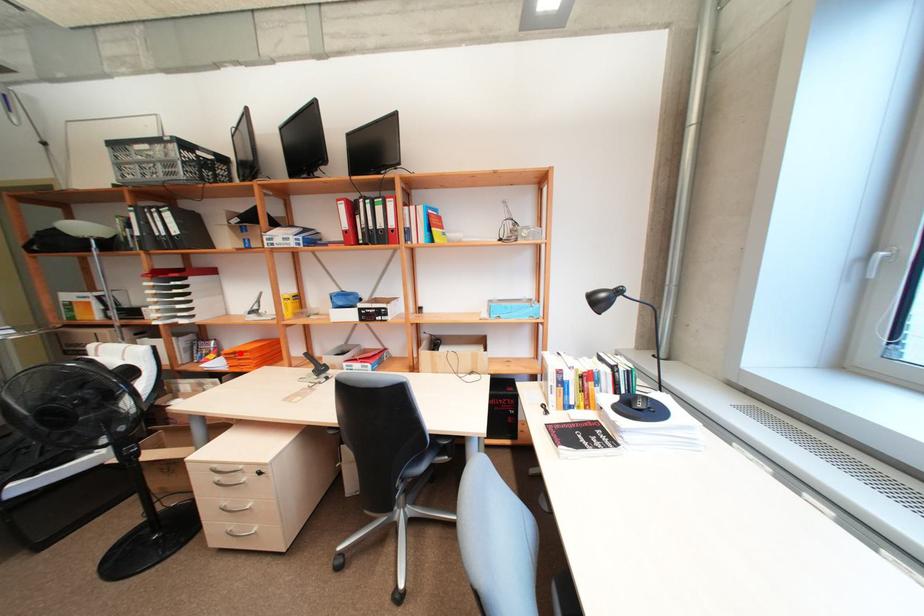
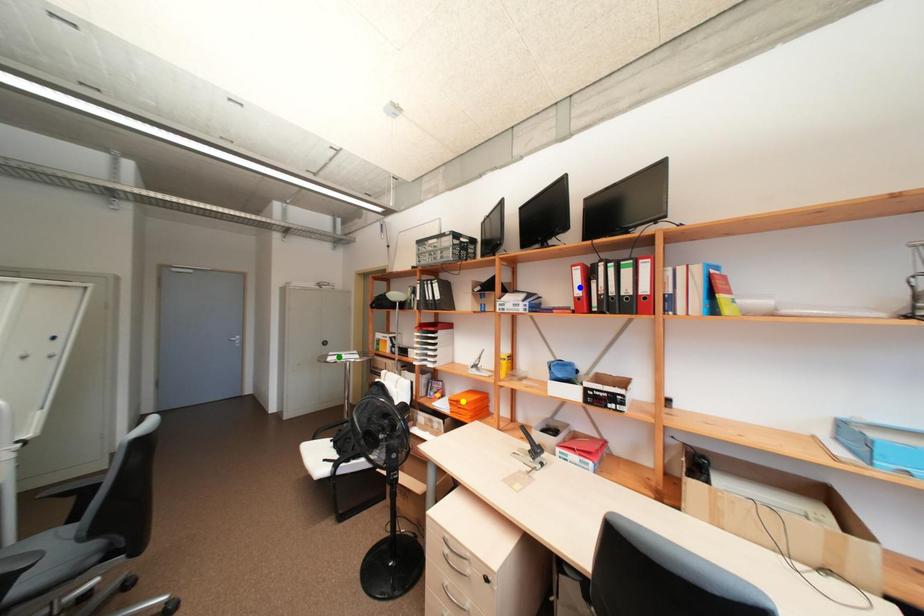
Question: I am providing you with two images of the same scene from different viewpoints. A red point is marked on the first image. You are given multiple points on the second image. In image 2, which mark is for the same physical point as the one in image 1?

Choices:
 (A) yellow point
 (B) blue point
 (C) green point

Answer: (A)